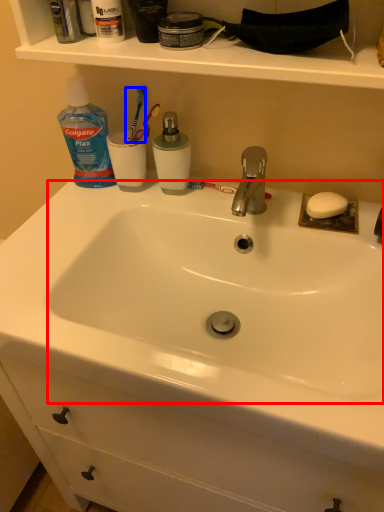
Question: Which object appears farthest to the camera in this image, sink (highlighted by a red box) or toothbrush (highlighted by a blue box)?

Choices:
 (A) sink
 (B) toothbrush

Answer: (B)